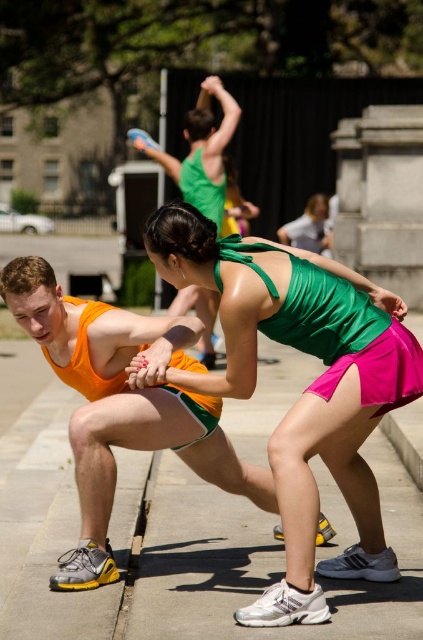
You are standing at the origin point in the image and see two points labeled as point (30, 316) and point (400, 452). Which point is closer to you?

Point (30, 316) is in front of point (400, 452), so it is closer to you.

You are standing at the origin of a coordinate system placed at the bottom left corner of the image. A point is marked at coordinate (302, 392). Which object does this point correspond to?

The point at coordinate (302, 392) corresponds to the green satin tank top at center.

Based on the photo, you are a photographer trying to capture a closeup of the orange matte tank top at left and the concrete at lower right in the image. Which object should you zoom in on to ensure both are in focus without moving the camera?

The orange matte tank top at left is larger in size than concrete at lower right, so you should zoom in on the orange matte tank top at left to ensure both are in focus without moving the camera.